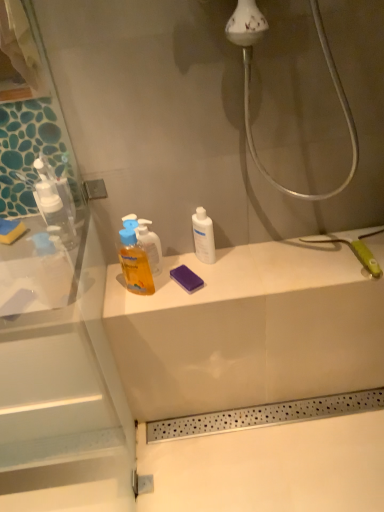
Identify the location of free space to the right of translucent plastic bottle at center. (196, 280).